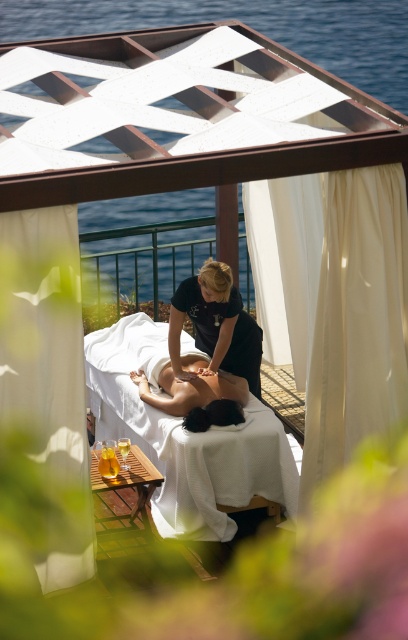
Question: Is white silk curtain at right to the right of white smooth bed at center from the viewer's perspective?

Choices:
 (A) yes
 (B) no

Answer: (A)

Question: Among these points, which one is farthest from the camera?

Choices:
 (A) (210, 321)
 (B) (224, 392)
 (C) (181, 484)
 (D) (387, 384)

Answer: (A)

Question: Does white sheer curtain at left appear under white smooth bed at center?

Choices:
 (A) no
 (B) yes

Answer: (A)

Question: Which point appears closest to the camera in this image?

Choices:
 (A) (66, 580)
 (B) (237, 340)
 (C) (359, 388)
 (D) (135, 314)

Answer: (A)

Question: Which object is positioned closest to the smooth skin at center?

Choices:
 (A) black smooth uniform at center
 (B) white sheer curtain at left

Answer: (A)

Question: Considering the relative positions of white sheer curtain at left and black smooth uniform at center in the image provided, where is white sheer curtain at left located with respect to black smooth uniform at center?

Choices:
 (A) above
 (B) below

Answer: (B)